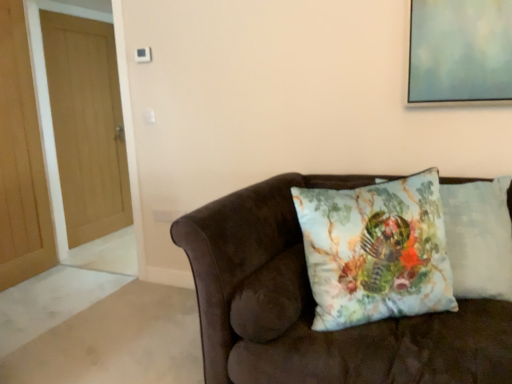
Question: Considering the relative sizes of light brown wood door at left, which ranks as the 2th door in back-to-front order, and velvet brown couch at center in the image provided, is light brown wood door at left, which ranks as the 2th door in back-to-front order, wider than velvet brown couch at center?

Choices:
 (A) no
 (B) yes

Answer: (A)

Question: Is light brown wood door at left, arranged as the 1th door when viewed from the front, bigger than velvet brown couch at center?

Choices:
 (A) yes
 (B) no

Answer: (B)

Question: Can we say light brown wood door at left, which ranks as the 2th door in back-to-front order, lies outside velvet brown couch at center?

Choices:
 (A) yes
 (B) no

Answer: (A)

Question: Considering the relative sizes of light brown wood door at left, arranged as the 1th door when viewed from the front, and velvet brown couch at center in the image provided, is light brown wood door at left, arranged as the 1th door when viewed from the front, shorter than velvet brown couch at center?

Choices:
 (A) no
 (B) yes

Answer: (A)

Question: Is light brown wood door at left, arranged as the 1th door when viewed from the front, facing away from velvet brown couch at center?

Choices:
 (A) no
 (B) yes

Answer: (A)

Question: Considering their positions, is light brown wood door at left, arranged as the 1th door when viewed from the front, located in front of or behind floral fabric cushion at right, the 2th pillow in the left-to-right sequence?

Choices:
 (A) front
 (B) behind

Answer: (B)

Question: In terms of height, does light brown wood door at left, arranged as the 1th door when viewed from the front, look taller or shorter compared to floral fabric cushion at right, which is the 1th pillow from right to left?

Choices:
 (A) tall
 (B) short

Answer: (A)

Question: From a real-world perspective, is light brown wood door at left, arranged as the 1th door when viewed from the front, physically located above or below floral fabric cushion at right, the 2th pillow in the left-to-right sequence?

Choices:
 (A) below
 (B) above

Answer: (B)

Question: Looking at the image, does light brown wood door at left, which ranks as the 2th door in back-to-front order, seem bigger or smaller compared to floral fabric cushion at right, the 2th pillow in the left-to-right sequence?

Choices:
 (A) small
 (B) big

Answer: (B)

Question: Considering the positions of light brown wood door at left, which ranks as the 2th door in back-to-front order, and floral cotton cushion at center, arranged as the 1th pillow when viewed from the left, in the image, is light brown wood door at left, which ranks as the 2th door in back-to-front order, taller or shorter than floral cotton cushion at center, arranged as the 1th pillow when viewed from the left,?

Choices:
 (A) tall
 (B) short

Answer: (A)

Question: From the image's perspective, is light brown wood door at left, arranged as the 1th door when viewed from the front, located above or below floral cotton cushion at center, positioned as the 2th pillow in right-to-left order?

Choices:
 (A) above
 (B) below

Answer: (A)

Question: From a real-world perspective, is light brown wood door at left, arranged as the 1th door when viewed from the front, positioned above or below floral cotton cushion at center, positioned as the 2th pillow in right-to-left order?

Choices:
 (A) above
 (B) below

Answer: (A)

Question: Considering the positions of point (12, 193) and point (332, 314), is point (12, 193) closer or farther from the camera than point (332, 314)?

Choices:
 (A) farther
 (B) closer

Answer: (A)

Question: From a real-world perspective, is velvet brown couch at center physically located above or below floral cotton cushion at center, positioned as the 2th pillow in right-to-left order?

Choices:
 (A) above
 (B) below

Answer: (B)

Question: Is velvet brown couch at center in front of or behind floral cotton cushion at center, positioned as the 2th pillow in right-to-left order, in the image?

Choices:
 (A) behind
 (B) front

Answer: (B)